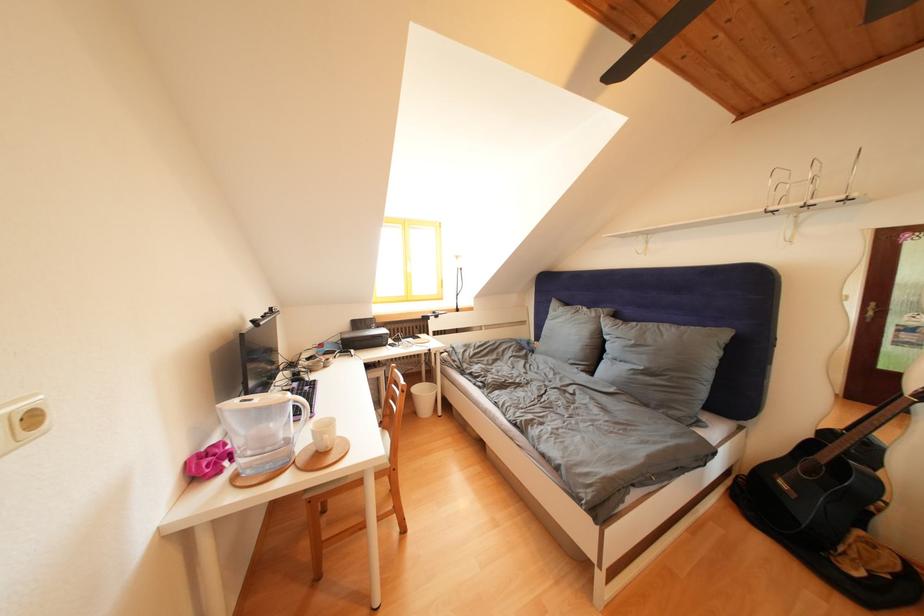
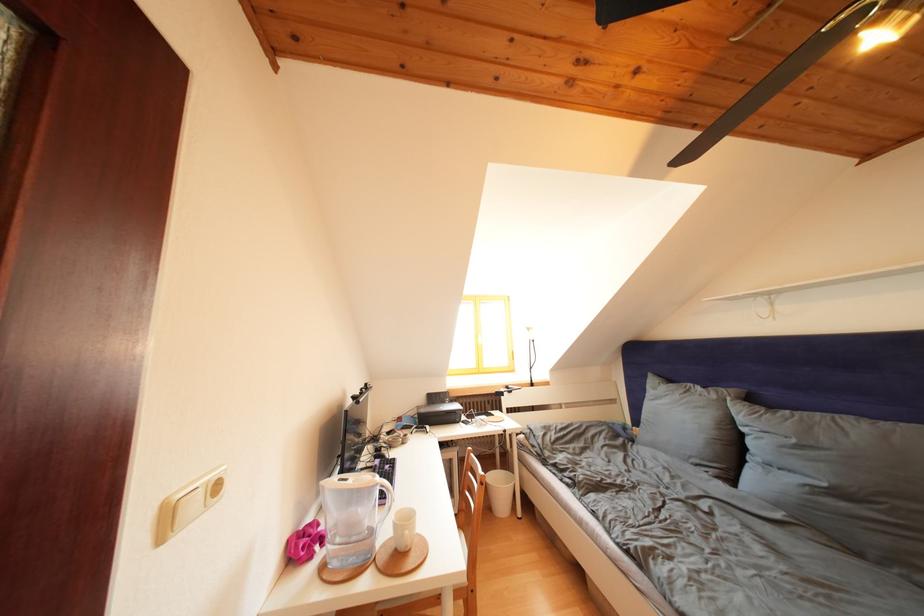
Where in the second image is the point corresponding to point (602, 320) from the first image?

(722, 402)